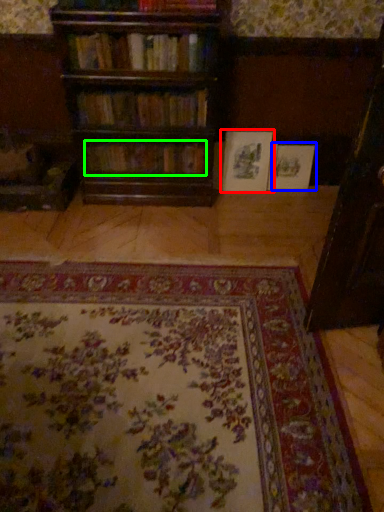
Question: Which is farther away from book (highlighted by a red box)? book (highlighted by a blue box) or book (highlighted by a green box)?

Choices:
 (A) book
 (B) book

Answer: (B)